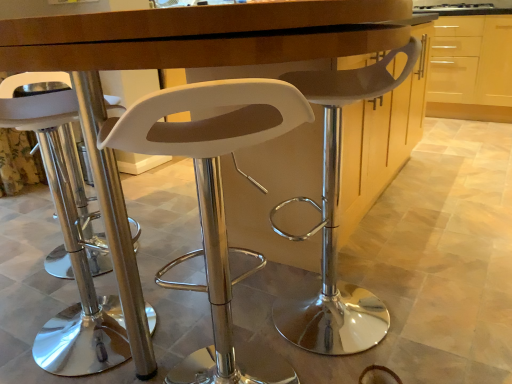
Identify the location of white plastic stool at left, positioned as the 3th chair in right-to-left order. (66, 241).

The height and width of the screenshot is (384, 512). In order to click on white plastic stool at center, which ranks as the 2th chair in right-to-left order in this screenshot , I will do `click(214, 200)`.

What is the approximate width of white plastic stool at center, which is counted as the 3th chair, starting from the left?

Result: white plastic stool at center, which is counted as the 3th chair, starting from the left, is 26.76 inches wide.

Find the location of `white plastic stool at left, which is counted as the first chair, starting from the left`. white plastic stool at left, which is counted as the first chair, starting from the left is located at coordinates (66, 241).

Can you confirm if light wood cabinet at upper right is shorter than white plastic stool at center, which ranks as the 2th chair in right-to-left order?

Incorrect, the height of light wood cabinet at upper right does not fall short of that of white plastic stool at center, which ranks as the 2th chair in right-to-left order.

Is light wood cabinet at upper right in front of white plastic stool at center, acting as the 2th chair starting from the left?

No, it is behind white plastic stool at center, acting as the 2th chair starting from the left.

Which point is more forward, (468,62) or (149,116)?

The point (149,116) is in front.

Between light wood cabinet at upper right and white plastic stool at center, which ranks as the 2th chair in right-to-left order, which one appears on the right side from the viewer's perspective?

Positioned to the right is light wood cabinet at upper right.

From a real-world perspective, between white plastic stool at left, which is counted as the first chair, starting from the left, and white plastic stool at center, marked as the 1th chair in a right-to-left arrangement, who is vertically lower?

white plastic stool at left, which is counted as the first chair, starting from the left, is physically lower.

Can you confirm if white plastic stool at left, positioned as the 3th chair in right-to-left order, is shorter than white plastic stool at center, marked as the 1th chair in a right-to-left arrangement?

Yes.

Is white plastic stool at left, positioned as the 3th chair in right-to-left order, next to white plastic stool at center, which is counted as the 3th chair, starting from the left, and touching it?

No, white plastic stool at left, positioned as the 3th chair in right-to-left order, is not making contact with white plastic stool at center, which is counted as the 3th chair, starting from the left.

Starting from the light wood cabinet at upper right, which chair is the 1st one in front? Please provide its 2D coordinates.

[(336, 219)]

How many degrees apart are the facing directions of white plastic stool at center, marked as the 1th chair in a right-to-left arrangement, and light wood cabinet at upper right?

The facing directions of white plastic stool at center, marked as the 1th chair in a right-to-left arrangement, and light wood cabinet at upper right are 89 degrees apart.

Looking at this image, does white plastic stool at center, marked as the 1th chair in a right-to-left arrangement, lie behind light wood cabinet at upper right?

No, white plastic stool at center, marked as the 1th chair in a right-to-left arrangement, is closer to the viewer.

Can you tell me how much white plastic stool at left, positioned as the 3th chair in right-to-left order, and light wood cabinet at upper right differ in facing direction?

There is a 154-degree angle between the facing directions of white plastic stool at left, positioned as the 3th chair in right-to-left order, and light wood cabinet at upper right.

Does point (45, 144) come behind point (470, 89)?

That is False.

At what (x,y) coordinates should I click in order to perform the action: click on cabinetry on the right of white plastic stool at left, positioned as the 3th chair in right-to-left order. Please return your answer as a coordinate pair (x, y). This screenshot has height=384, width=512. Looking at the image, I should click on (471, 68).

Is white plastic stool at left, positioned as the 3th chair in right-to-left order, surrounding light wood cabinet at upper right?

No, light wood cabinet at upper right is not surrounded by white plastic stool at left, positioned as the 3th chair in right-to-left order.

Which object is positioned more to the left, white plastic stool at center, which is counted as the 3th chair, starting from the left, or white plastic stool at left, positioned as the 3th chair in right-to-left order?

white plastic stool at left, positioned as the 3th chair in right-to-left order, is more to the left.

Between white plastic stool at center, marked as the 1th chair in a right-to-left arrangement, and white plastic stool at left, positioned as the 3th chair in right-to-left order, which one has larger size?

white plastic stool at center, marked as the 1th chair in a right-to-left arrangement.

Is the surface of white plastic stool at center, marked as the 1th chair in a right-to-left arrangement, in direct contact with white plastic stool at left, which is counted as the first chair, starting from the left?

No, white plastic stool at center, marked as the 1th chair in a right-to-left arrangement, is not making contact with white plastic stool at left, which is counted as the first chair, starting from the left.

You are a GUI agent. You are given a task and a screenshot of the screen. Output one action in this format:
    pyautogui.click(x=<x>, y=<y>)
    Task: Click on the 2nd chair located above the white plastic stool at left, positioned as the 3th chair in right-to-left order (from a real-world perspective)
    
    Given the screenshot: What is the action you would take?
    pyautogui.click(x=336, y=219)

Is white plastic stool at center, which ranks as the 2th chair in right-to-left order, at the back of white plastic stool at center, which is counted as the 3th chair, starting from the left?

white plastic stool at center, which is counted as the 3th chair, starting from the left, is not turned away from white plastic stool at center, which ranks as the 2th chair in right-to-left order.

Which is behind, point (409, 53) or point (231, 289)?

The point (231, 289) is behind.

Considering the relative sizes of white plastic stool at center, which is counted as the 3th chair, starting from the left, and white plastic stool at center, acting as the 2th chair starting from the left, in the image provided, is white plastic stool at center, which is counted as the 3th chair, starting from the left, smaller than white plastic stool at center, acting as the 2th chair starting from the left,?

Incorrect, white plastic stool at center, which is counted as the 3th chair, starting from the left, is not smaller in size than white plastic stool at center, acting as the 2th chair starting from the left.

From a real-world perspective, who is located lower, white plastic stool at center, marked as the 1th chair in a right-to-left arrangement, or white plastic stool at center, acting as the 2th chair starting from the left?

white plastic stool at center, acting as the 2th chair starting from the left.

Choose the correct answer: Is white plastic stool at center, acting as the 2th chair starting from the left, inside light wood cabinet at upper right or outside it?

white plastic stool at center, acting as the 2th chair starting from the left, lies outside light wood cabinet at upper right.

Which object is thinner, white plastic stool at center, which ranks as the 2th chair in right-to-left order, or light wood cabinet at upper right?

With smaller width is white plastic stool at center, which ranks as the 2th chair in right-to-left order.

Is white plastic stool at center, which ranks as the 2th chair in right-to-left order, bigger than light wood cabinet at upper right?

No.

Relative to light wood cabinet at upper right, is white plastic stool at center, acting as the 2th chair starting from the left, in front or behind?

Visually, white plastic stool at center, acting as the 2th chair starting from the left, is located in front of light wood cabinet at upper right.

This screenshot has height=384, width=512. What are the coordinates of `the 2nd chair to the left when counting from the light wood cabinet at upper right` in the screenshot? It's located at (214, 200).

This screenshot has height=384, width=512. Identify the location of the 1st chair positioned below the white plastic stool at center, marked as the 1th chair in a right-to-left arrangement (from the image's perspective). (66, 241).

Looking at this image, which object lies further to the anchor point white plastic stool at center, which is counted as the 3th chair, starting from the left, white plastic stool at left, which is counted as the first chair, starting from the left, or light wood cabinet at upper right?

light wood cabinet at upper right lies further to white plastic stool at center, which is counted as the 3th chair, starting from the left, than the other object.

Based on their spatial positions, is light wood cabinet at upper right or white plastic stool at left, which is counted as the first chair, starting from the left, further from white plastic stool at center, which is counted as the 3th chair, starting from the left?

The object further to white plastic stool at center, which is counted as the 3th chair, starting from the left, is light wood cabinet at upper right.

Estimate the real-world distances between objects in this image. Which object is closer to light wood cabinet at upper right, white plastic stool at left, positioned as the 3th chair in right-to-left order, or white plastic stool at center, marked as the 1th chair in a right-to-left arrangement?

Based on the image, white plastic stool at center, marked as the 1th chair in a right-to-left arrangement, appears to be nearer to light wood cabinet at upper right.

Based on their spatial positions, is white plastic stool at center, marked as the 1th chair in a right-to-left arrangement, or light wood cabinet at upper right further from white plastic stool at center, acting as the 2th chair starting from the left?

light wood cabinet at upper right lies further to white plastic stool at center, acting as the 2th chair starting from the left, than the other object.

Based on the photo, which object lies further to the anchor point light wood cabinet at upper right, white plastic stool at center, acting as the 2th chair starting from the left, or white plastic stool at left, positioned as the 3th chair in right-to-left order?

The object further to light wood cabinet at upper right is white plastic stool at left, positioned as the 3th chair in right-to-left order.

Considering their positions, is white plastic stool at left, positioned as the 3th chair in right-to-left order, positioned closer to white plastic stool at center, acting as the 2th chair starting from the left, than white plastic stool at center, which is counted as the 3th chair, starting from the left?

white plastic stool at center, which is counted as the 3th chair, starting from the left, is closer to white plastic stool at center, acting as the 2th chair starting from the left.

Looking at the image, which one is located further to white plastic stool at center, which ranks as the 2th chair in right-to-left order, light wood cabinet at upper right or white plastic stool at left, which is counted as the first chair, starting from the left?

light wood cabinet at upper right is further to white plastic stool at center, which ranks as the 2th chair in right-to-left order.

Which object lies nearer to the anchor point white plastic stool at center, marked as the 1th chair in a right-to-left arrangement, white plastic stool at left, which is counted as the first chair, starting from the left, or white plastic stool at center, acting as the 2th chair starting from the left?

white plastic stool at center, acting as the 2th chair starting from the left.

Identify the location of chair between white plastic stool at left, positioned as the 3th chair in right-to-left order, and light wood cabinet at upper right from front to back. (336, 219).

Where is `chair between white plastic stool at left, positioned as the 3th chair in right-to-left order, and white plastic stool at center, which is counted as the 3th chair, starting from the left, from left to right`? This screenshot has height=384, width=512. chair between white plastic stool at left, positioned as the 3th chair in right-to-left order, and white plastic stool at center, which is counted as the 3th chair, starting from the left, from left to right is located at coordinates pyautogui.click(x=214, y=200).